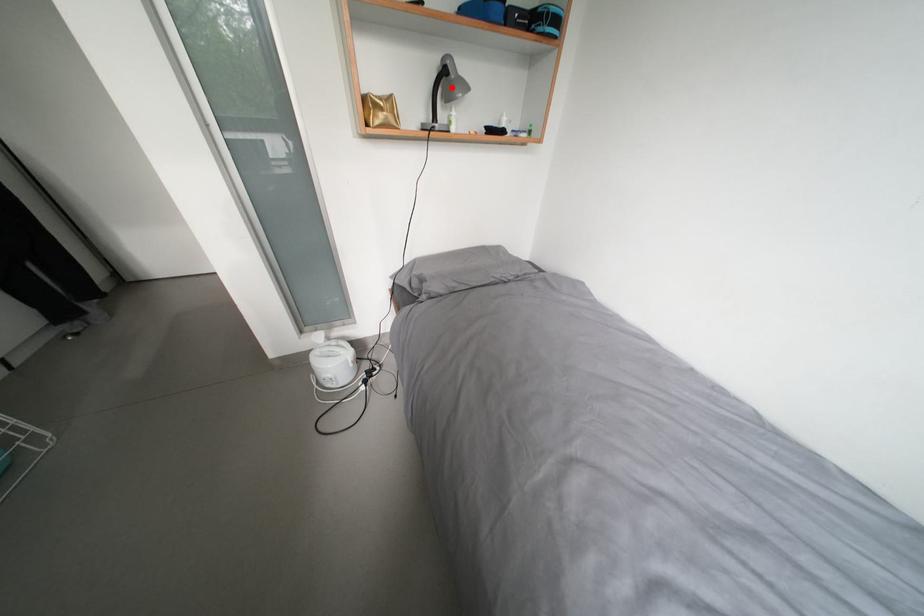
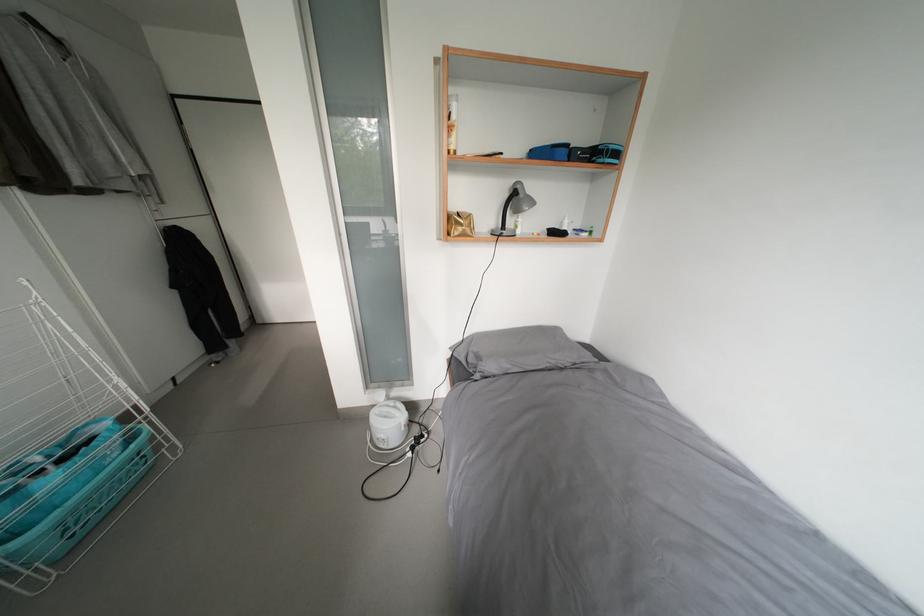
Find the pixel in the second image that matches the highlighted location in the first image.

(521, 205)